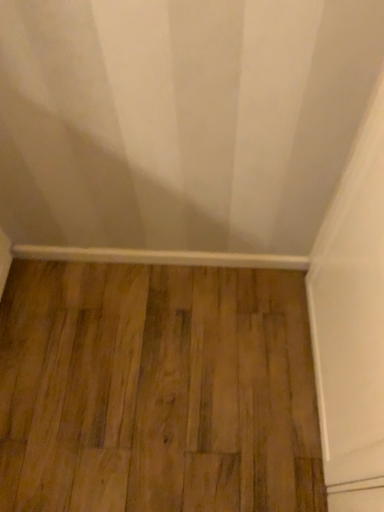
Locate an element on the screen. free location above brown wood flooring at center (from a real-world perspective) is located at coordinates (174, 372).